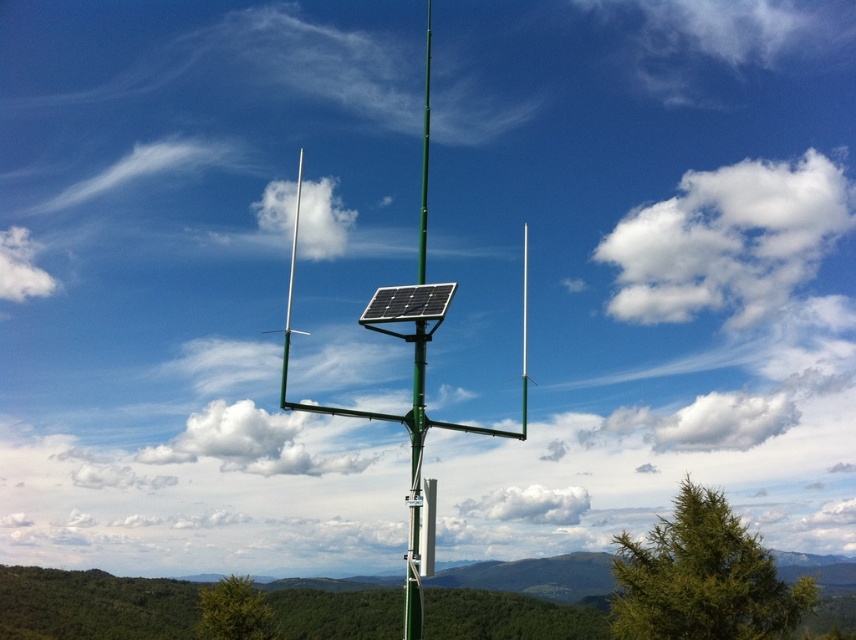
Does green metallic antenna at center have a lesser height compared to black rigid solar panel at center?

Incorrect, green metallic antenna at center's height does not fall short of black rigid solar panel at center's.

Is point (431, 545) positioned after point (444, 289)?

No.

Locate an element on the screen. green metallic antenna at center is located at coordinates (409, 435).

Is green metallic pole at center to the left of black rigid solar panel at center from the viewer's perspective?

Yes, green metallic pole at center is to the left of black rigid solar panel at center.

Who is positioned more to the left, green metallic pole at center or black rigid solar panel at center?

green metallic pole at center

Is point (413, 333) less distant than point (432, 305)?

Yes.

The width and height of the screenshot is (856, 640). Find the location of `green metallic pole at center`. green metallic pole at center is located at coordinates (417, 484).

Can you confirm if green metallic antenna at center is shorter than green metallic pole at center?

Incorrect, green metallic antenna at center's height does not fall short of green metallic pole at center's.

Between green metallic antenna at center and green metallic pole at center, which one appears on the right side from the viewer's perspective?

Positioned to the right is green metallic antenna at center.

Which is in front, point (406, 579) or point (414, 637)?

Point (414, 637) is more forward.

The height and width of the screenshot is (640, 856). What are the coordinates of `green metallic antenna at center` in the screenshot? It's located at (409, 435).